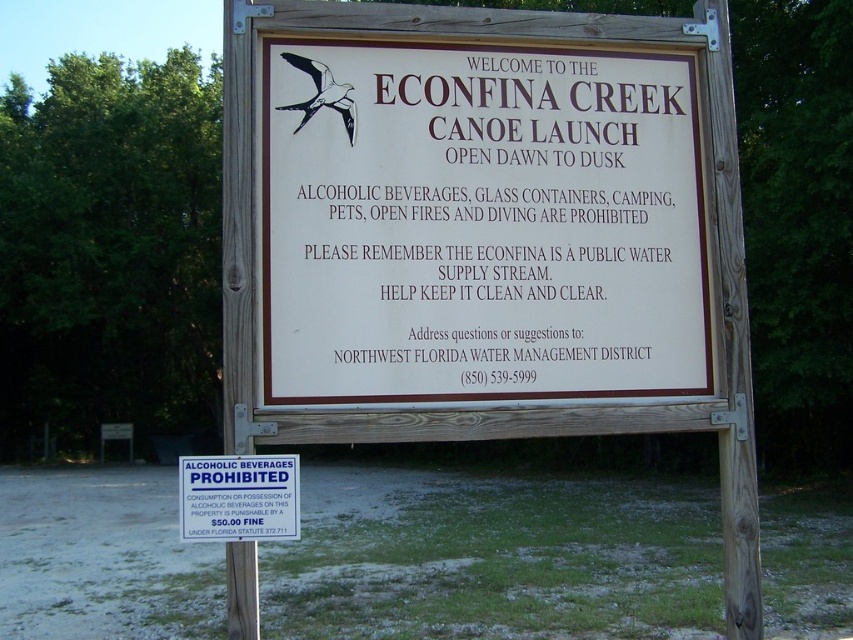
Question: Is white wood sign at center to the right of blue plastic sign at center from the viewer's perspective?

Choices:
 (A) yes
 (B) no

Answer: (A)

Question: Considering the relative positions of white wood sign at center and blue plastic sign at center in the image provided, where is white wood sign at center located with respect to blue plastic sign at center?

Choices:
 (A) right
 (B) left

Answer: (A)

Question: Which of the following is the closest to the observer?

Choices:
 (A) (422, 292)
 (B) (178, 524)

Answer: (A)

Question: Which point appears farthest from the camera in this image?

Choices:
 (A) (178, 509)
 (B) (612, 250)

Answer: (A)

Question: Where is white wood sign at center located in relation to blue plastic sign at center in the image?

Choices:
 (A) left
 (B) right

Answer: (B)